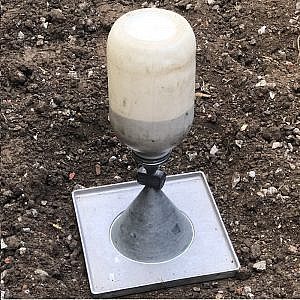
The image size is (300, 300). Identify the location of stand. (31, 50).